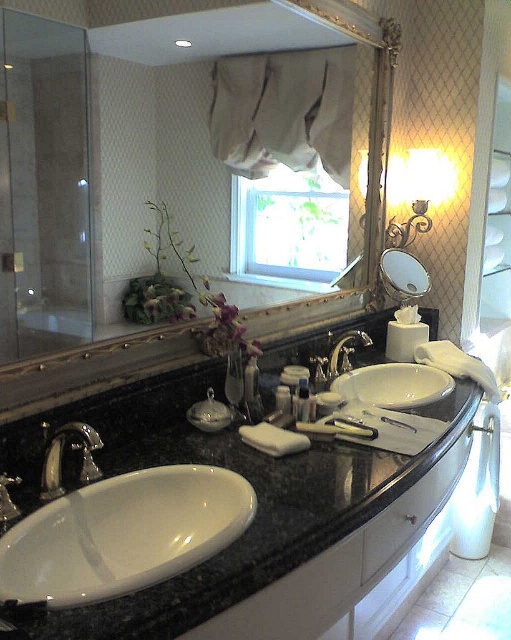
Between black granite countertop at center and matte glass mirror at upper center, which one appears on the right side from the viewer's perspective?

matte glass mirror at upper center is more to the right.

Who is higher up, black granite countertop at center or matte glass mirror at upper center?

matte glass mirror at upper center is higher up.

Does point (383, 506) lie behind point (426, 273)?

No, it is not.

Where is `black granite countertop at center`? black granite countertop at center is located at coordinates (230, 468).

Does white glossy sink at lower left have a greater height compared to white glossy sink at center?

Indeed, white glossy sink at lower left has a greater height compared to white glossy sink at center.

Does white glossy sink at lower left come in front of white glossy sink at center?

Yes.

Which is in front, point (14, 528) or point (333, 381)?

Point (14, 528)

Image resolution: width=511 pixels, height=640 pixels. Identify the location of white glossy sink at lower left. (124, 534).

Based on the photo, between white glossy sink at center and matte plastic container at center, which one has less height?

Standing shorter between the two is matte plastic container at center.

The image size is (511, 640). I want to click on white glossy sink at center, so click(x=393, y=385).

This screenshot has height=640, width=511. Describe the element at coordinates (393, 385) in the screenshot. I see `white glossy sink at center` at that location.

This screenshot has width=511, height=640. In order to click on white glossy sink at center in this screenshot , I will do [x=393, y=385].